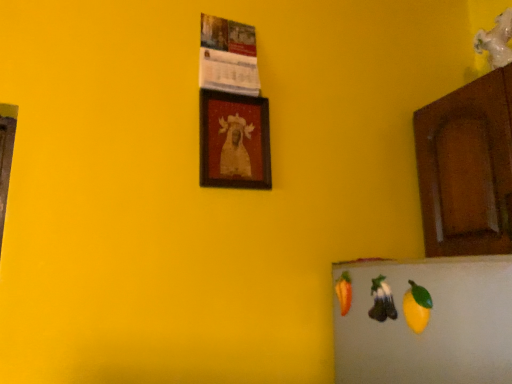
Question: Does yellow matte fruit at lower right, which is counted as the first fruit, starting from the front, have a larger size compared to shiny purple grapes at lower right, which is the 1th fruit from back to front?

Choices:
 (A) yes
 (B) no

Answer: (B)

Question: Considering the relative sizes of yellow matte fruit at lower right, which is counted as the first fruit, starting from the front, and shiny purple grapes at lower right, which is the 1th fruit from back to front, in the image provided, is yellow matte fruit at lower right, which is counted as the first fruit, starting from the front, shorter than shiny purple grapes at lower right, which is the 1th fruit from back to front,?

Choices:
 (A) no
 (B) yes

Answer: (A)

Question: Can shiny purple grapes at lower right, which is the 1th fruit from back to front, be found inside yellow matte fruit at lower right, which is counted as the first fruit, starting from the front?

Choices:
 (A) no
 (B) yes

Answer: (A)

Question: Does yellow matte fruit at lower right, which is counted as the first fruit, starting from the front, lie behind shiny purple grapes at lower right, which is the 1th fruit from back to front?

Choices:
 (A) yes
 (B) no

Answer: (B)

Question: Can you confirm if yellow matte fruit at lower right, which is the second fruit in back-to-front order, is smaller than shiny purple grapes at lower right, which is the 1th fruit from back to front?

Choices:
 (A) yes
 (B) no

Answer: (A)

Question: Is yellow matte fruit at lower right, which is counted as the first fruit, starting from the front, to the left of shiny purple grapes at lower right, the second fruit from the front, from the viewer's perspective?

Choices:
 (A) yes
 (B) no

Answer: (B)

Question: From a real-world perspective, is brown wood cabinet at right on top of yellow matte fruit at lower right, which is counted as the first fruit, starting from the front?

Choices:
 (A) no
 (B) yes

Answer: (B)

Question: Is brown wood cabinet at right smaller than yellow matte fruit at lower right, which is the second fruit in back-to-front order?

Choices:
 (A) yes
 (B) no

Answer: (B)

Question: From a real-world perspective, does brown wood cabinet at right sit lower than yellow matte fruit at lower right, which is counted as the first fruit, starting from the front?

Choices:
 (A) yes
 (B) no

Answer: (B)

Question: Does brown wood cabinet at right lie behind yellow matte fruit at lower right, which is counted as the first fruit, starting from the front?

Choices:
 (A) yes
 (B) no

Answer: (A)

Question: Is brown wood cabinet at right closer to the viewer compared to yellow matte fruit at lower right, which is counted as the first fruit, starting from the front?

Choices:
 (A) no
 (B) yes

Answer: (A)

Question: Is brown wood cabinet at right next to yellow matte fruit at lower right, which is counted as the first fruit, starting from the front?

Choices:
 (A) yes
 (B) no

Answer: (B)

Question: Is brown wood cabinet at right shorter than shiny purple grapes at lower right, which is the 1th fruit from back to front?

Choices:
 (A) yes
 (B) no

Answer: (B)